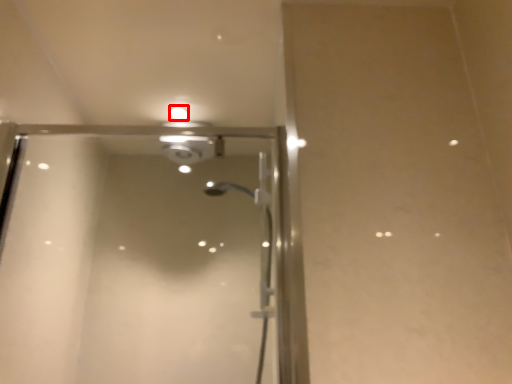
Question: From the image's perspective, what is the correct spatial relationship of droplight (annotated by the red box) in relation to screen door?

Choices:
 (A) above
 (B) below

Answer: (A)